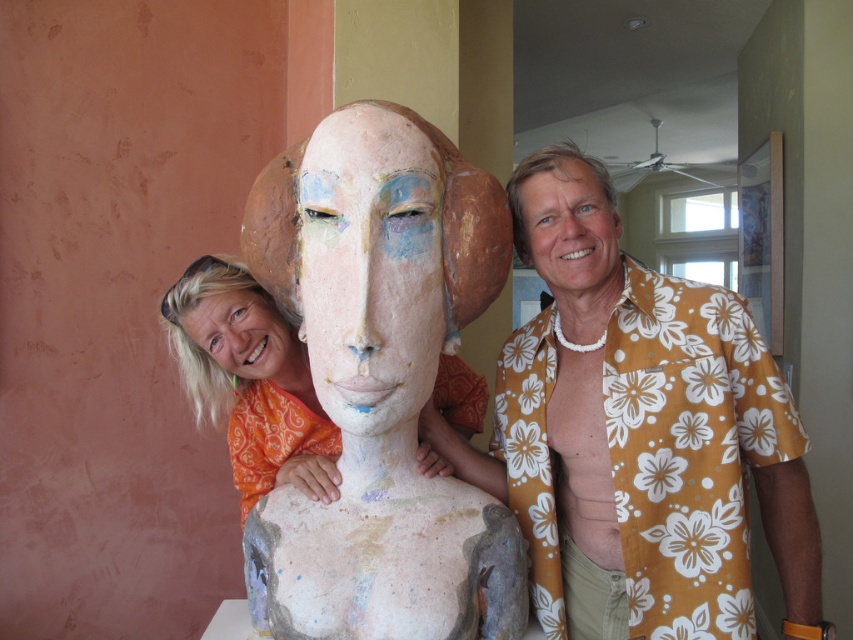
Can you confirm if orange floral shirt at center is shorter than matte clay bust at center?

Yes.

Who is positioned more to the left, orange floral shirt at center or matte clay bust at center?

Positioned to the left is matte clay bust at center.

The width and height of the screenshot is (853, 640). I want to click on orange floral shirt at center, so click(624, 410).

Is point (728, 544) farther from camera compared to point (611, 243)?

No.

Does point (699, 381) lie behind point (590, 333)?

That is False.

The image size is (853, 640). What are the coordinates of `orange floral shirt at center` in the screenshot? It's located at (624, 410).

Does point (625, 556) come in front of point (425, 188)?

No.

Is point (738, 307) behind point (370, 291)?

Yes, point (738, 307) is farther from viewer.

From the picture: Who is more forward, (584, 456) or (369, 125)?

Point (369, 125) is more forward.

Identify the location of yellow floral shirt at right. (642, 433).